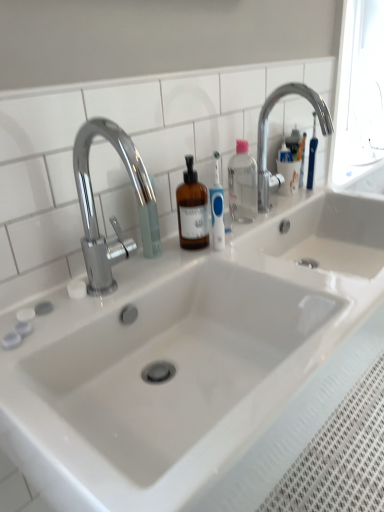
Question: Can you confirm if clear plastic bottle at center is bigger than chrome metallic faucet at upper right, the 2th tap in the left-to-right sequence?

Choices:
 (A) yes
 (B) no

Answer: (B)

Question: Is clear plastic bottle at center not inside chrome metallic faucet at upper right, which is counted as the first tap, starting from the right?

Choices:
 (A) yes
 (B) no

Answer: (A)

Question: Is clear plastic bottle at center facing away from chrome metallic faucet at upper right, the 2th tap in the left-to-right sequence?

Choices:
 (A) yes
 (B) no

Answer: (B)

Question: Is chrome metallic faucet at upper right, which is counted as the first tap, starting from the right, located within clear plastic bottle at center?

Choices:
 (A) yes
 (B) no

Answer: (B)

Question: Is clear plastic bottle at center at the left side of chrome metallic faucet at upper right, which appears as the 2th tap when viewed from the front?

Choices:
 (A) yes
 (B) no

Answer: (A)

Question: From a real-world perspective, is clear plastic bottle at center under chrome metallic faucet at upper right, which is counted as the 1th tap, starting from the back?

Choices:
 (A) yes
 (B) no

Answer: (A)

Question: Considering the relative positions of clear plastic bottle at center and chrome metallic faucet at left, the 1th tap from the front, in the image provided, is clear plastic bottle at center behind chrome metallic faucet at left, the 1th tap from the front,?

Choices:
 (A) no
 (B) yes

Answer: (B)

Question: Is clear plastic bottle at center positioned far away from chrome metallic faucet at left, acting as the 2th tap starting from the back?

Choices:
 (A) no
 (B) yes

Answer: (A)

Question: Are clear plastic bottle at center and chrome metallic faucet at left, which is counted as the second tap, starting from the right, making contact?

Choices:
 (A) yes
 (B) no

Answer: (B)

Question: Is clear plastic bottle at center outside chrome metallic faucet at left, arranged as the 1th tap when viewed from the left?

Choices:
 (A) yes
 (B) no

Answer: (A)

Question: Is clear plastic bottle at center oriented towards chrome metallic faucet at left, the 1th tap from the front?

Choices:
 (A) yes
 (B) no

Answer: (B)

Question: Would you say chrome metallic faucet at left, arranged as the 1th tap when viewed from the left, is part of clear plastic bottle at center's contents?

Choices:
 (A) no
 (B) yes

Answer: (A)

Question: From a real-world perspective, is chrome metallic faucet at upper right, the 2th tap in the left-to-right sequence, physically above chrome metallic faucet at left, arranged as the 1th tap when viewed from the left?

Choices:
 (A) no
 (B) yes

Answer: (B)